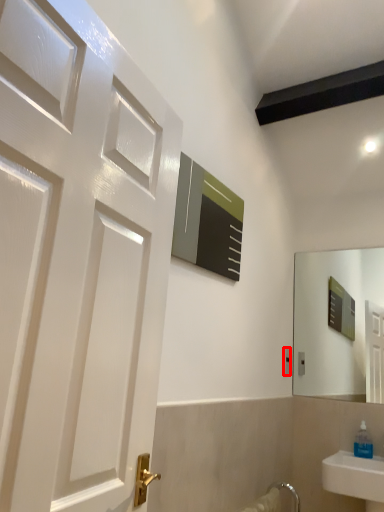
Question: Observing the image, what is the correct spatial positioning of electric outlet (annotated by the red box) in reference to soap dispenser?

Choices:
 (A) left
 (B) right

Answer: (A)